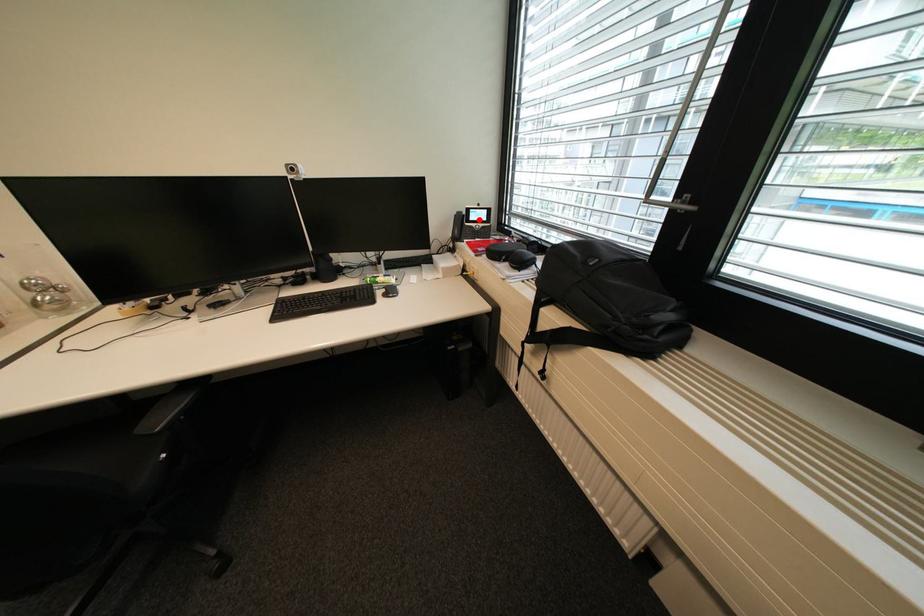
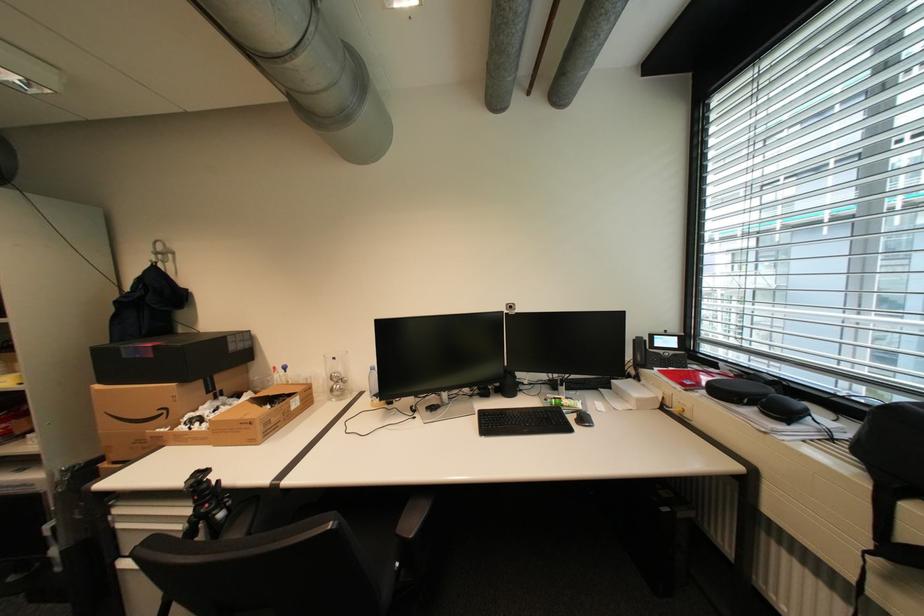
Question: I am providing you with two images of the same scene from different viewpoints. Image1 has a red point marked. In image2, the corresponding 3D location appears at what relative position? Reply with the corresponding letter.

Choices:
 (A) Closer
 (B) Farther

Answer: (B)